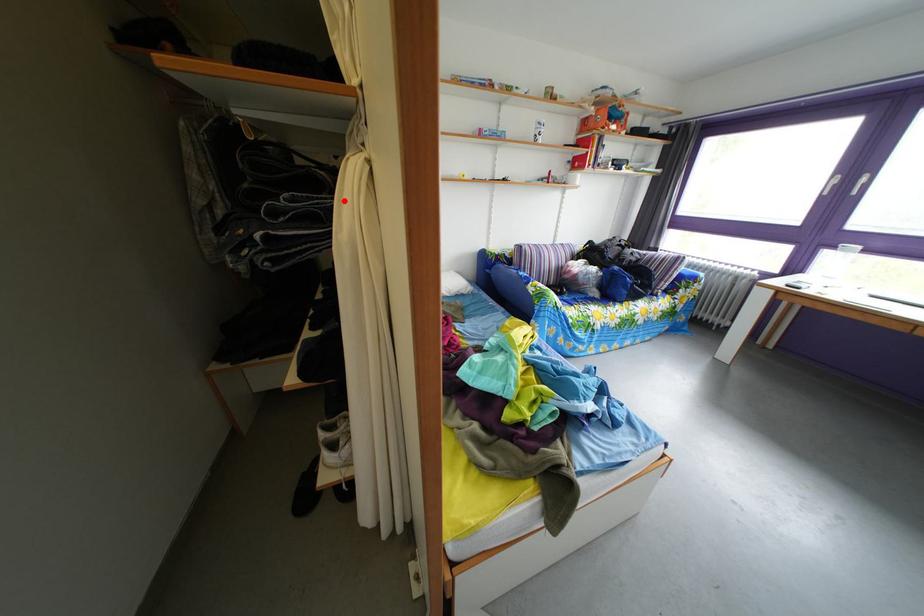
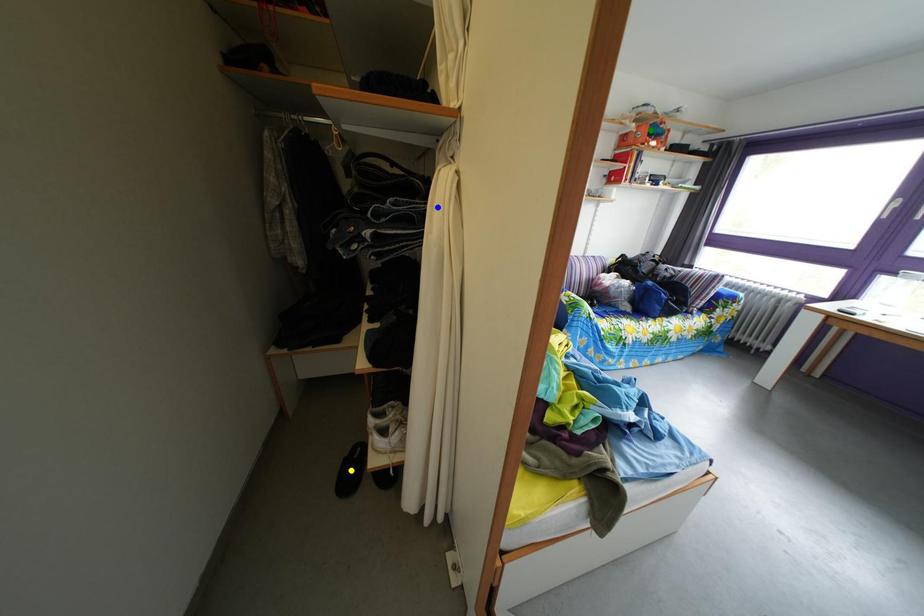
Question: I am providing you with two images of the same scene from different viewpoints. A red point is marked on the first image. You are given multiple points on the second image. Can you choose the point in image 2 that corresponds to the point in image 1?

Choices:
 (A) yellow point
 (B) green point
 (C) blue point

Answer: (C)